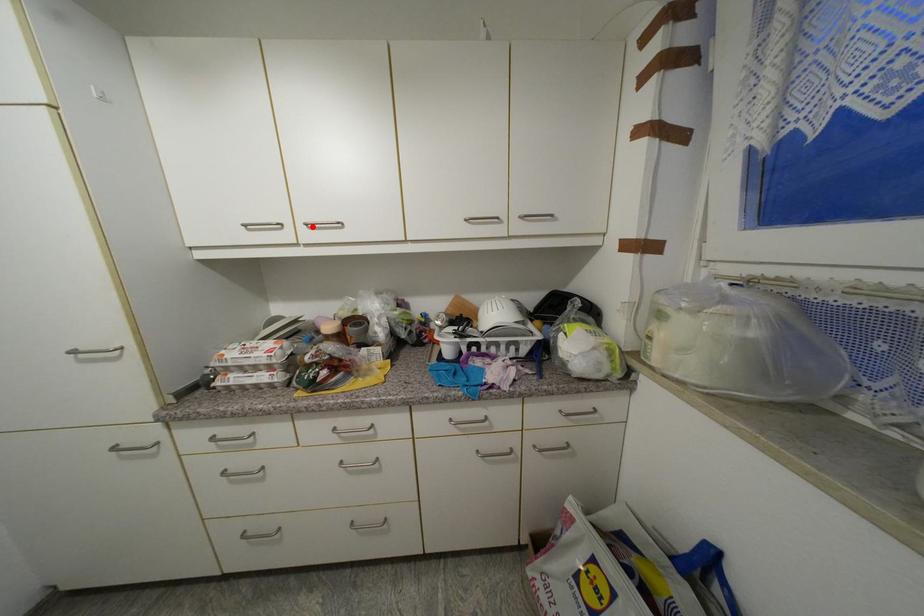
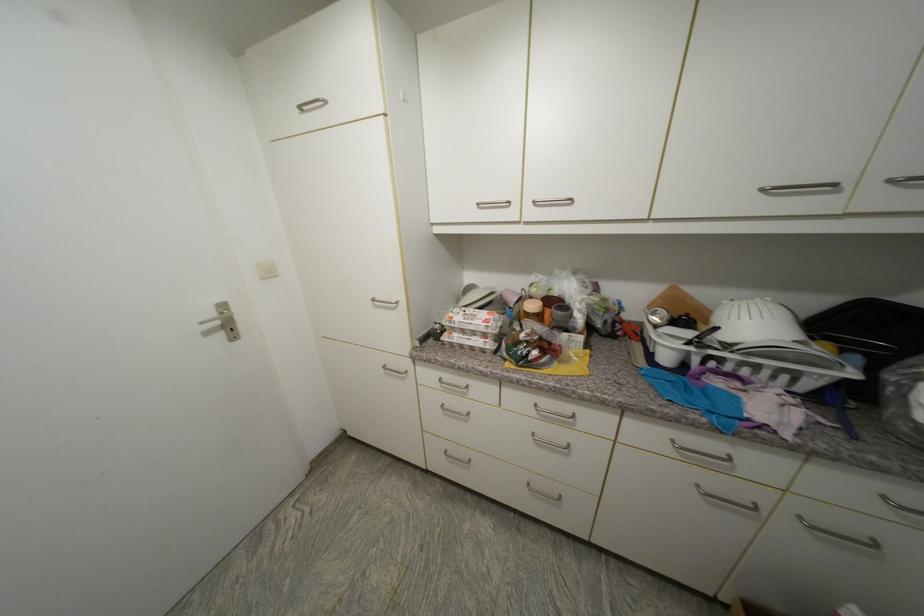
The point at the highlighted location is marked in the first image. Where is the corresponding point in the second image?

(540, 204)